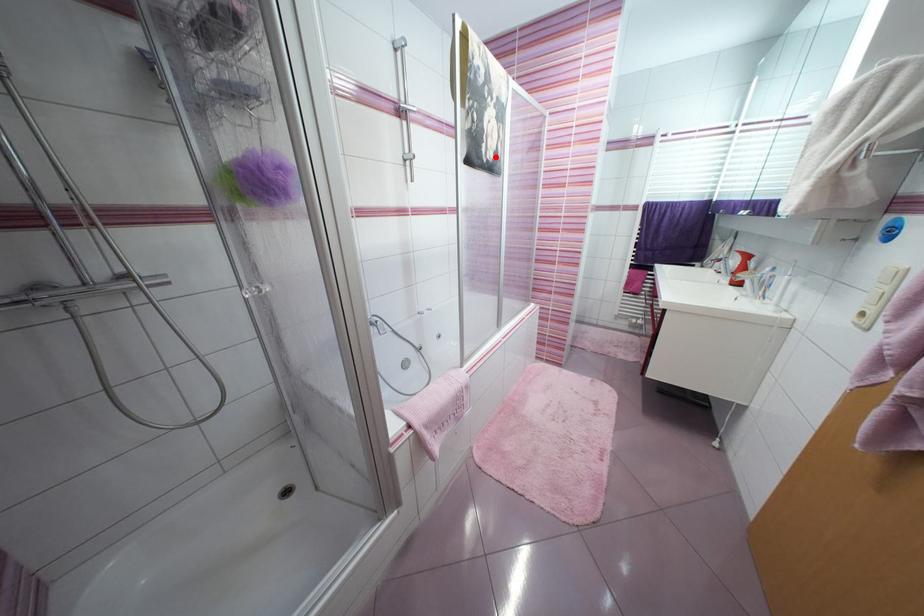
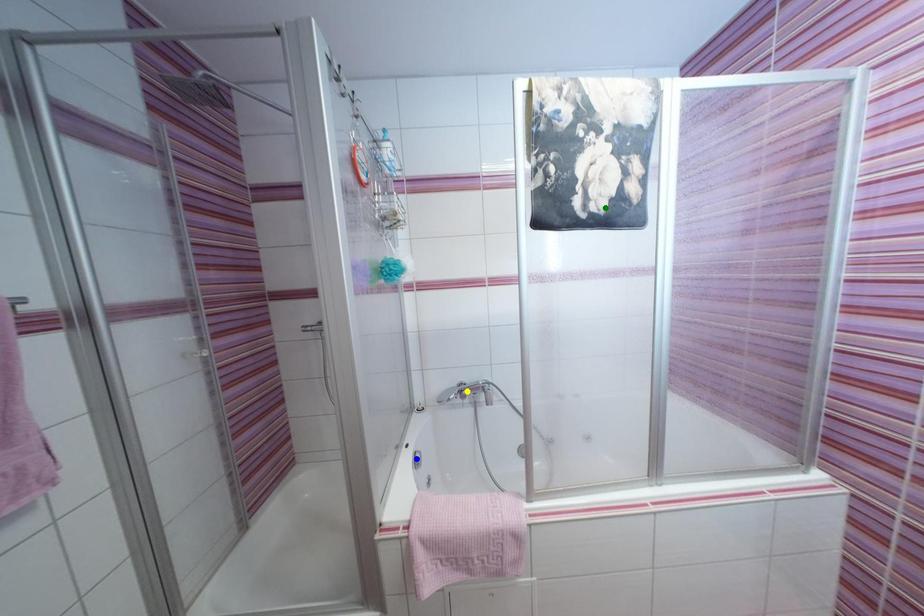
Question: I am providing you with two images of the same scene from different viewpoints. A red point is marked on the first image. You are given multiple points on the second image. Which spot in image 2 lines up with the point in image 1?

Choices:
 (A) blue point
 (B) yellow point
 (C) green point

Answer: (C)